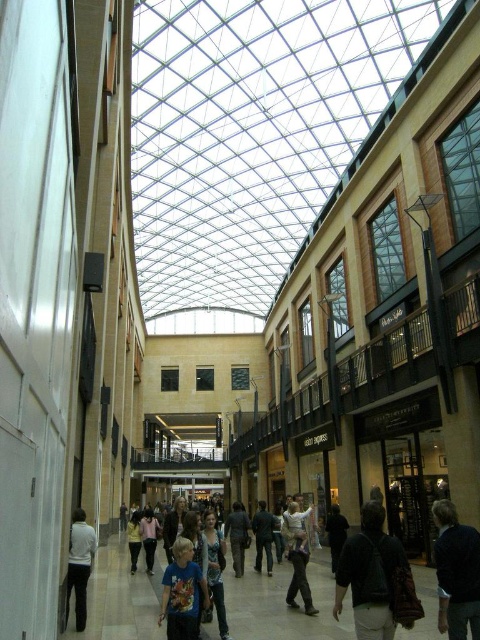
You are standing at point [179,595] and want to walk to the Vision Express store located at point [478,618]. Is the Vision Express store ahead of you or behind you?

The Vision Express store at point [478,618] is in front of point [179,595], so it is ahead of you.